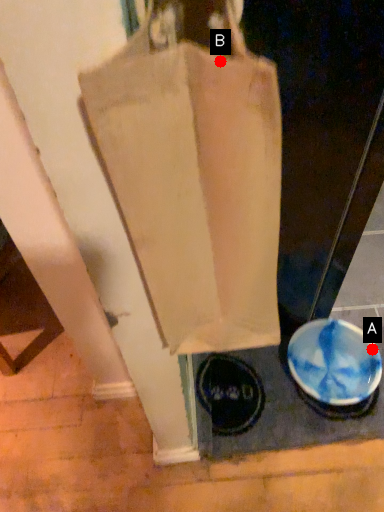
Question: Two points are circled on the image, labeled by A and B beside each circle. Which of the following is the farthest from the observer?

Choices:
 (A) A is further
 (B) B is further

Answer: (A)